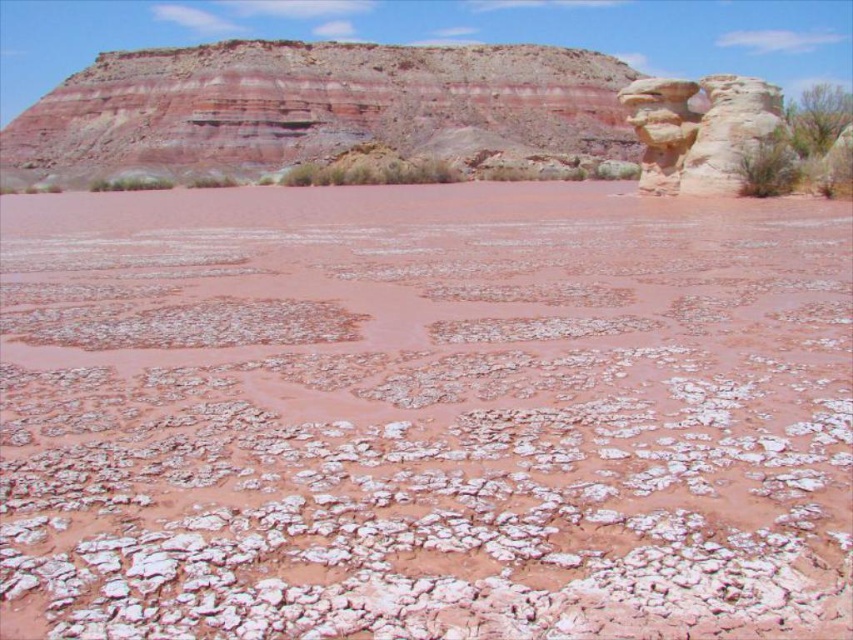
You are a geologist examining the desert scene. You need to determine the relative positions of the dried mud at center and the smooth sandstone rock formation at upper right. Which object is positioned to the right of the other?

The smooth sandstone rock formation at upper right is positioned to the right of the dried mud at center.

You are standing at the point marked as point [422,413] in the desert scene. What type of terrain are you currently standing on?

The point [422,413] is on dried mud at center, so you are standing on dried mud terrain.